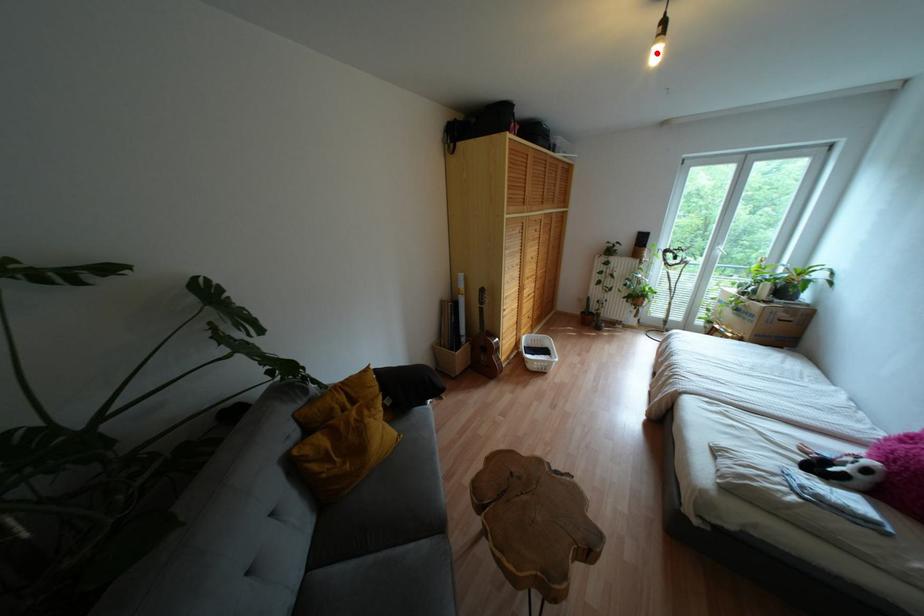
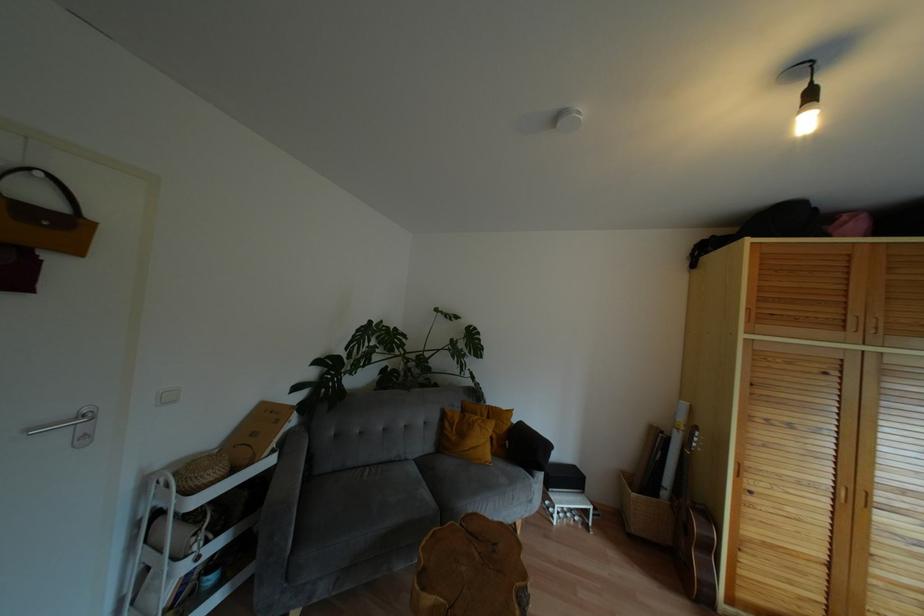
The point at the highlighted location is marked in the first image. Where is the corresponding point in the second image?

(806, 123)